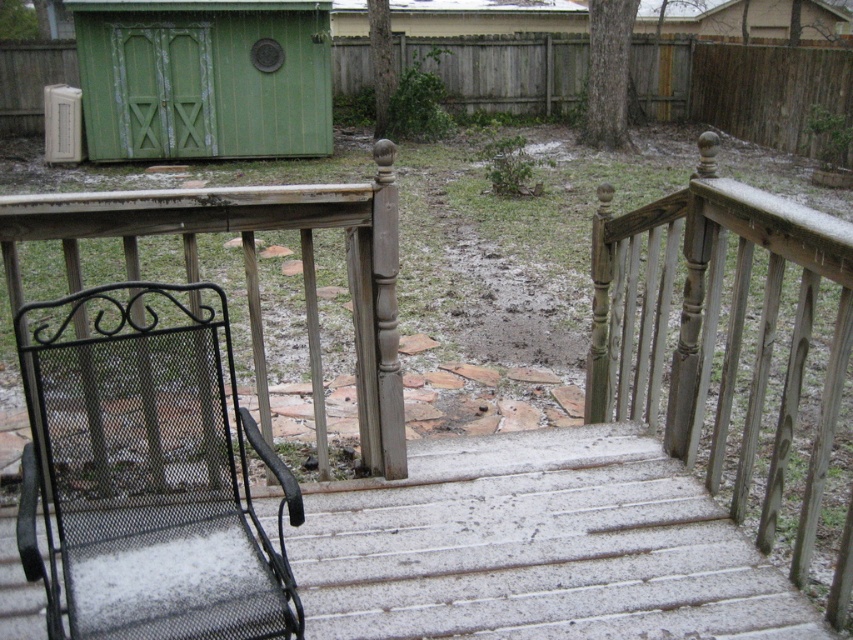
Question: Which point is farther to the camera?

Choices:
 (A) green wooden shed at upper left
 (B) black mesh chair at lower left

Answer: (A)

Question: Estimate the real-world distances between objects in this image. Which object is closer to the black mesh chair at lower left?

Choices:
 (A) green wooden shed at upper left
 (B) sanded wood rail at upper right

Answer: (B)

Question: Does sanded wood rail at upper right appear over green wooden shed at upper left?

Choices:
 (A) no
 (B) yes

Answer: (A)

Question: Does sanded wood rail at upper right appear on the right side of green wooden shed at upper left?

Choices:
 (A) yes
 (B) no

Answer: (A)

Question: Does black mesh chair at lower left appear under sanded wood rail at upper right?

Choices:
 (A) no
 (B) yes

Answer: (A)

Question: Which object is positioned farthest from the green wooden shed at upper left?

Choices:
 (A) sanded wood rail at upper right
 (B) black mesh chair at lower left

Answer: (A)